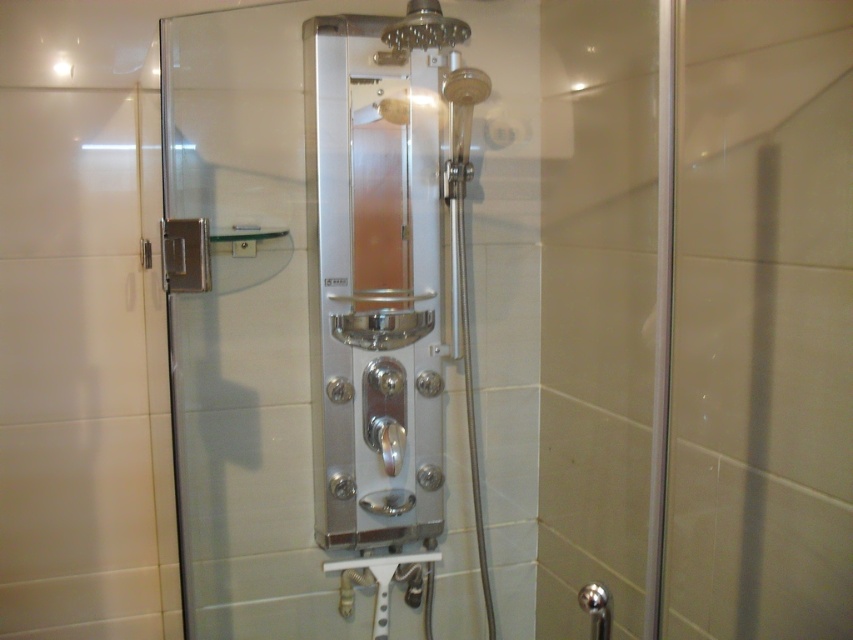
Question: Is silver metallic shower door at center below polished stainless steel shower enclosure at center?

Choices:
 (A) no
 (B) yes

Answer: (B)

Question: Which object appears farthest from the camera in this image?

Choices:
 (A) polished stainless steel shower enclosure at center
 (B) silver metallic shower door at center

Answer: (A)

Question: Is silver metallic shower door at center positioned in front of polished stainless steel shower enclosure at center?

Choices:
 (A) yes
 (B) no

Answer: (A)

Question: Is silver metallic shower door at center below polished stainless steel shower enclosure at center?

Choices:
 (A) yes
 (B) no

Answer: (A)